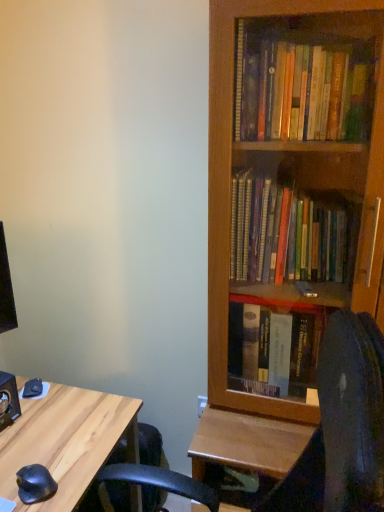
Question: From the image's perspective, is black rubber mouse at lower left over wooden bookcase at right?

Choices:
 (A) no
 (B) yes

Answer: (A)

Question: Is black rubber mouse at lower left thinner than wooden bookcase at right?

Choices:
 (A) no
 (B) yes

Answer: (B)

Question: From a real-world perspective, does black rubber mouse at lower left sit lower than wooden bookcase at right?

Choices:
 (A) yes
 (B) no

Answer: (A)

Question: Is black rubber mouse at lower left smaller than wooden bookcase at right?

Choices:
 (A) no
 (B) yes

Answer: (B)

Question: From the image's perspective, would you say black rubber mouse at lower left is shown under wooden bookcase at right?

Choices:
 (A) no
 (B) yes

Answer: (B)

Question: Considering the relative positions of black rubber mouse at lower left and wooden bookcase at right in the image provided, is black rubber mouse at lower left to the left of wooden bookcase at right from the viewer's perspective?

Choices:
 (A) yes
 (B) no

Answer: (A)

Question: Does black leather computer chair at lower right lie behind light wood desk at lower left?

Choices:
 (A) yes
 (B) no

Answer: (B)

Question: Does black leather computer chair at lower right contain light wood desk at lower left?

Choices:
 (A) yes
 (B) no

Answer: (B)

Question: Is black leather computer chair at lower right facing away from light wood desk at lower left?

Choices:
 (A) no
 (B) yes

Answer: (A)

Question: Considering the relative sizes of black leather computer chair at lower right and light wood desk at lower left in the image provided, is black leather computer chair at lower right wider than light wood desk at lower left?

Choices:
 (A) yes
 (B) no

Answer: (A)

Question: Considering the relative sizes of black leather computer chair at lower right and light wood desk at lower left in the image provided, is black leather computer chair at lower right thinner than light wood desk at lower left?

Choices:
 (A) no
 (B) yes

Answer: (A)

Question: Does black leather computer chair at lower right have a greater height compared to light wood desk at lower left?

Choices:
 (A) yes
 (B) no

Answer: (A)

Question: Is wooden bookcase at right not inside black rubber mouse at lower left?

Choices:
 (A) yes
 (B) no

Answer: (A)